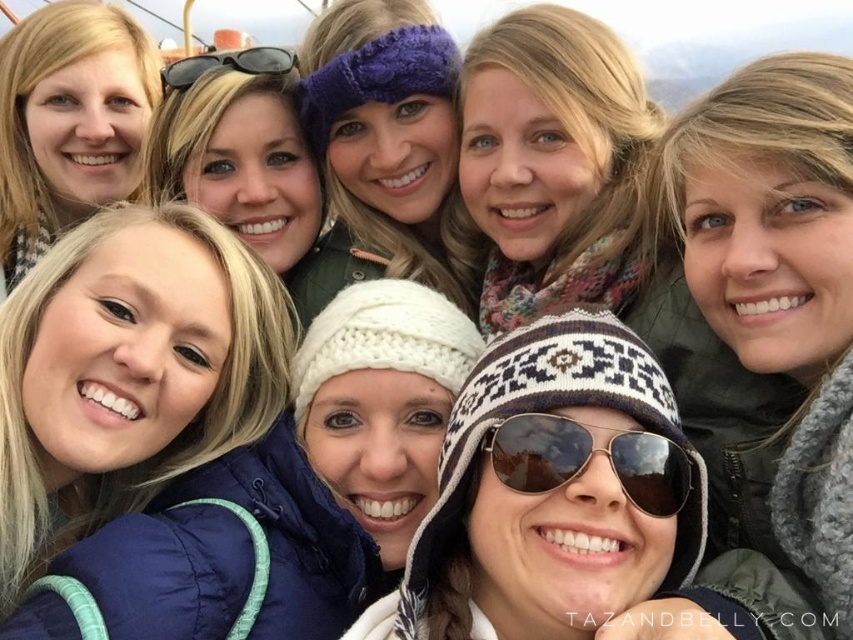
You are a photographer trying to capture a clear shot of the gold metallic goggles at center. However, the matte black hair at upper left is blocking your view. Can you determine if you need to adjust your camera angle upwards or downwards to avoid the obstruction?

The matte black hair at upper left is above the gold metallic goggles at center, so you need to adjust your camera angle downwards to avoid the obstruction.

Based on the photo, you are a photographer trying to capture a wide shot of the group. The white knitted hat at center and the black reflective sunglasses at upper left are part of the scene. Given their distance apart, do you think you can fit both into a single frame without zooming in? Assume your camera has a standard 50mm lens and you are 10 meters away from the group.

The white knitted hat at center and the black reflective sunglasses at upper left are 7.70 meters apart. With a standard 50mm lens at 10 meters, the camera can capture a horizontal field of view of approximately 8 meters. Since the distance between the two objects is within this range, both can be included in a single frame without zooming in.

You are trying to decide which scarf to take for a walk based on size. The gray knitted scarf at upper right and the floral scarf at upper center are your options. Which one is bigger?

The floral scarf at upper center is bigger than the gray knitted scarf at upper right.